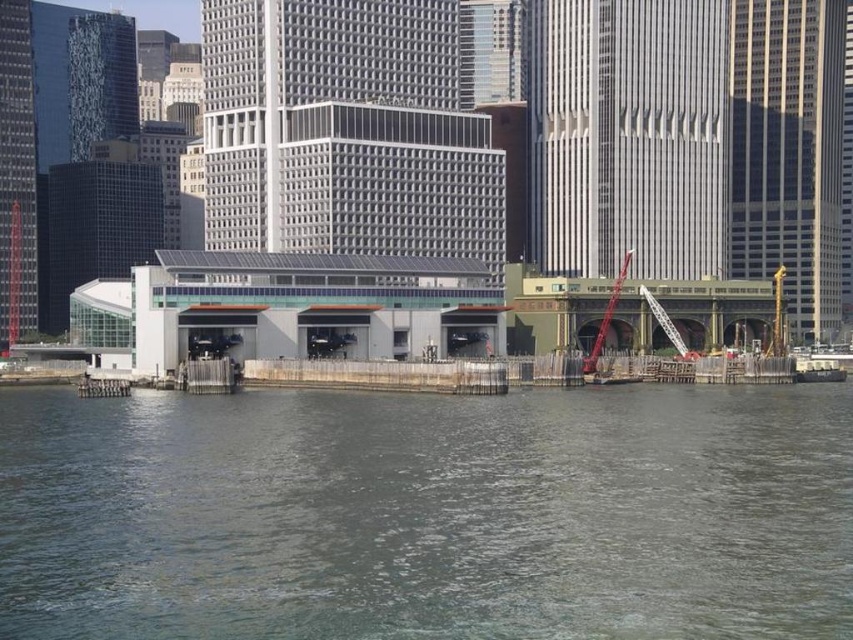
You are standing at the waterfront and want to take a photo of the gray concrete river at lower center and the metallic gray crane at center right. If you position yourself so that the crane is on your right side, will the river be to your left or right?

The gray concrete river at lower center is to the left of metallic gray crane at center right, so if the crane is on your right side, the river will be to your left.

You are standing at the waterfront and see two cranes at center right. Which crane is closer to you, the red metallic crane at center right or the metallic gray crane at center right?

The red metallic crane at center right is closer to the viewer than the metallic gray crane at center right.

In the scene shown: You are a photographer standing at the camera position. You want to capture a photo of the red metallic crane at center right. If your camera has a maximum focus range of 300 feet, will you be able to focus on the crane?

The red metallic crane at center right is 357.29 feet from camera, which exceeds the camera maximum focus range of 300 feet. Therefore, the camera cannot focus on the crane.